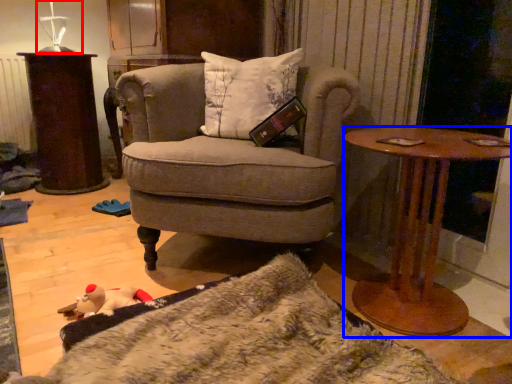
Question: Which object is further to the camera taking this photo, table lamp (highlighted by a red box) or desk (highlighted by a blue box)?

Choices:
 (A) table lamp
 (B) desk

Answer: (A)